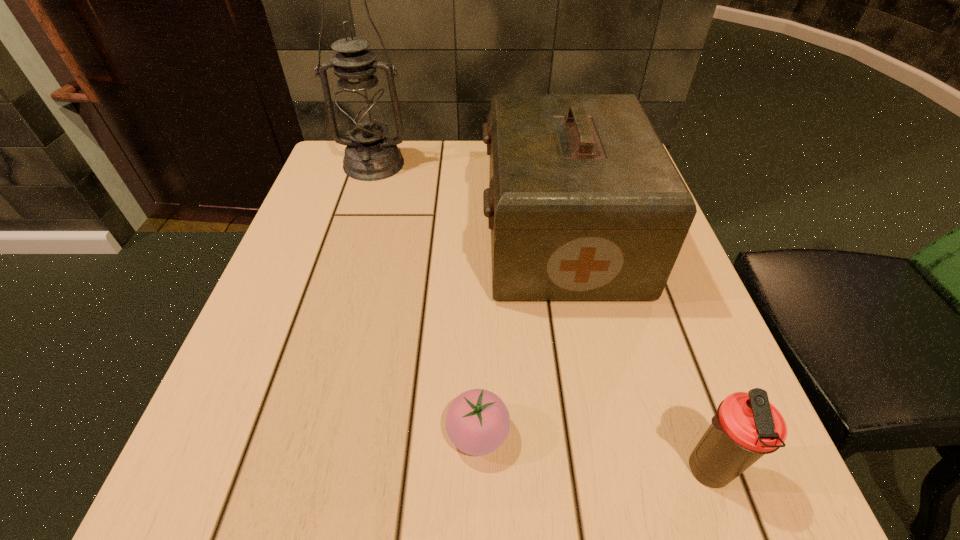
Identify the location of oil lamp that is at the far edge. This screenshot has height=540, width=960. (363, 112).

Where is `the first-aid kit located at the far edge`? This screenshot has width=960, height=540. the first-aid kit located at the far edge is located at coordinates (584, 203).

The image size is (960, 540). I want to click on thermos bottle situated at the near edge, so click(x=747, y=426).

Find the location of a particular element. tomato that is at the near edge is located at coordinates (477, 422).

Where is `object at the left edge`? The width and height of the screenshot is (960, 540). object at the left edge is located at coordinates [363, 112].

I want to click on the first-aid kit present at the right edge, so click(x=584, y=203).

Locate an element on the screen. thermos bottle located at the right edge is located at coordinates (747, 426).

Image resolution: width=960 pixels, height=540 pixels. What are the coordinates of `object positioned at the far left corner` in the screenshot? It's located at (363, 112).

This screenshot has width=960, height=540. I want to click on object at the far right corner, so click(x=584, y=203).

Find the location of a particular element. object present at the near right corner is located at coordinates [x=747, y=426].